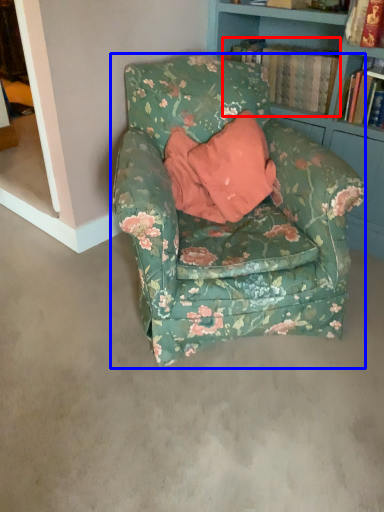
Question: Among these objects, which one is nearest to the camera, book (highlighted by a red box) or chair (highlighted by a blue box)?

Choices:
 (A) book
 (B) chair

Answer: (B)